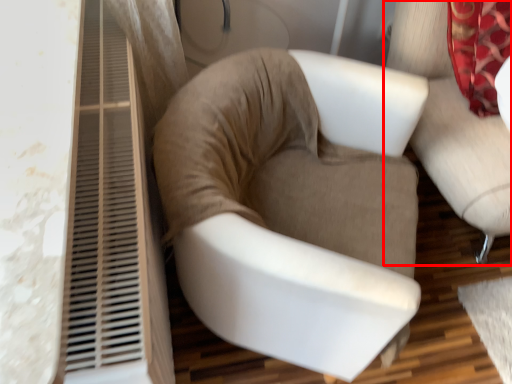
Question: Considering the relative positions of chair (annotated by the red box) and chair in the image provided, where is chair (annotated by the red box) located with respect to the staircase?

Choices:
 (A) left
 (B) right

Answer: (B)